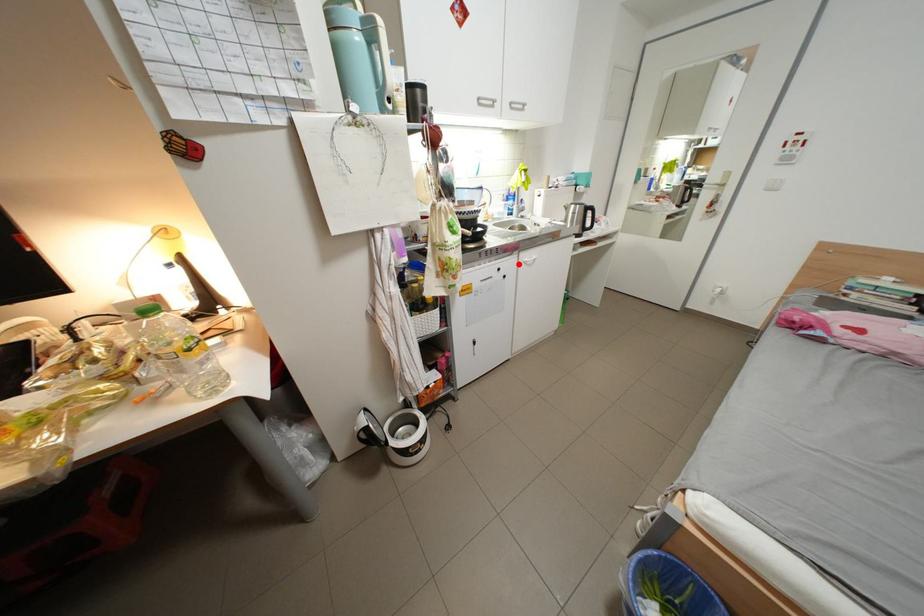
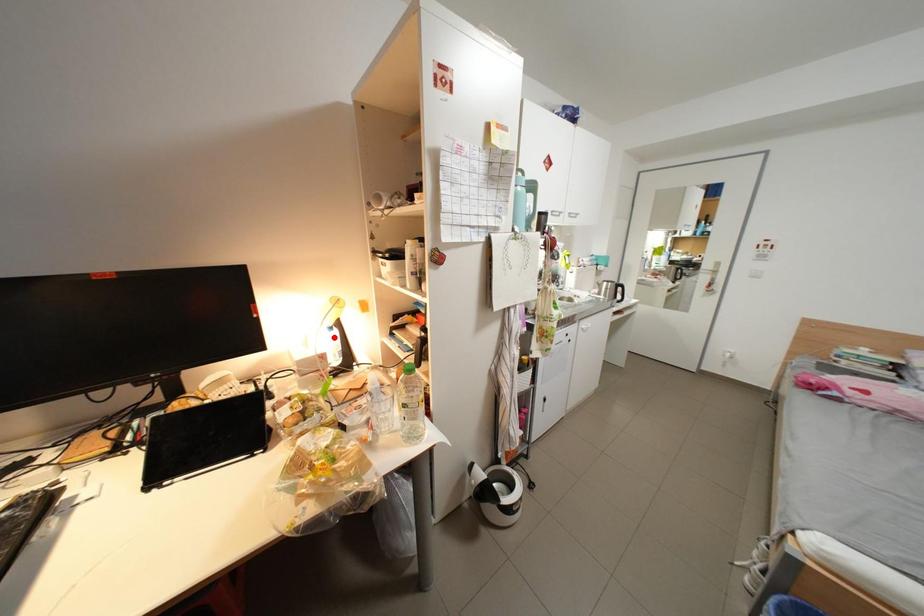
I am providing you with two images of the same scene from different viewpoints. A red point is marked on the first image and another point is marked on the second image. Is the red point in image1 aligned with the point shown in image2?

No